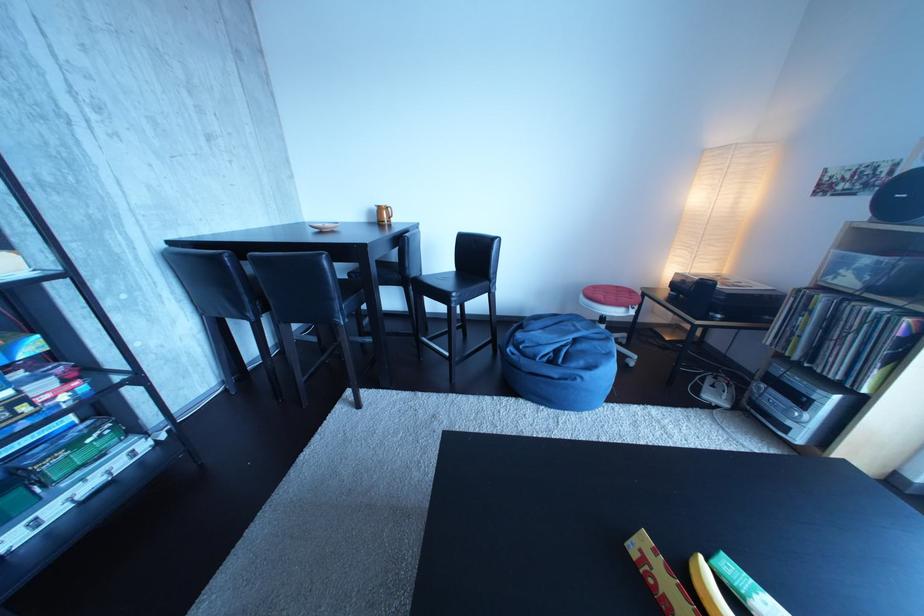
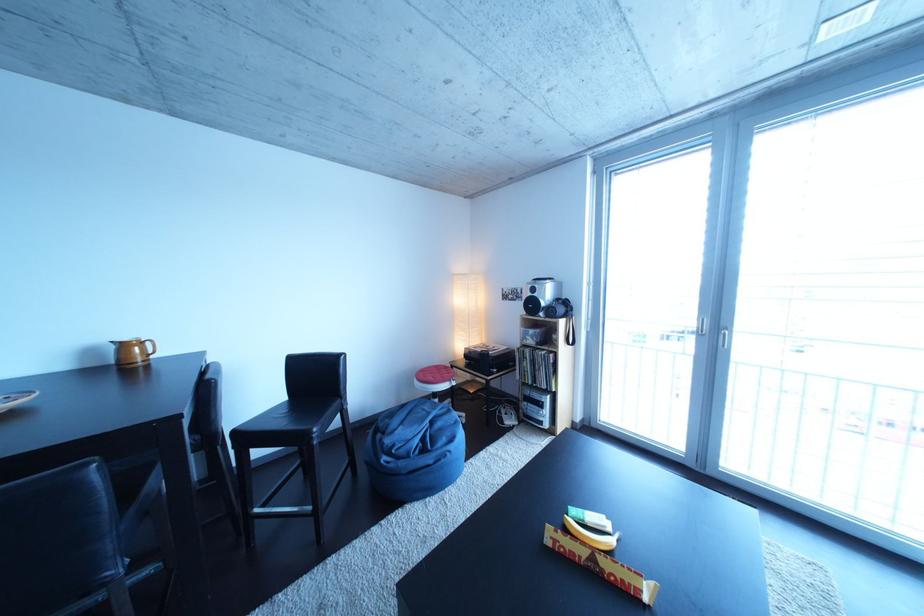
Find the pixel in the second image that matches (467,275) in the first image.

(299, 403)